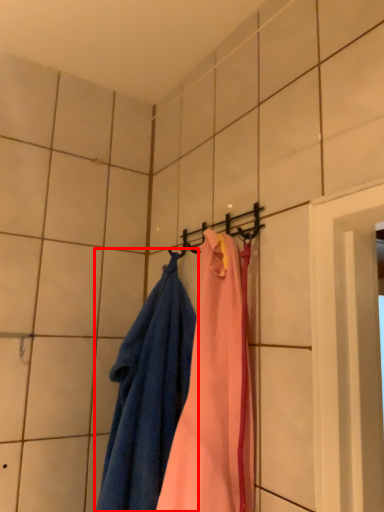
Question: From the image, what is the correct spatial relationship of towel (annotated by the red box) in relation to hanger?

Choices:
 (A) left
 (B) right

Answer: (A)